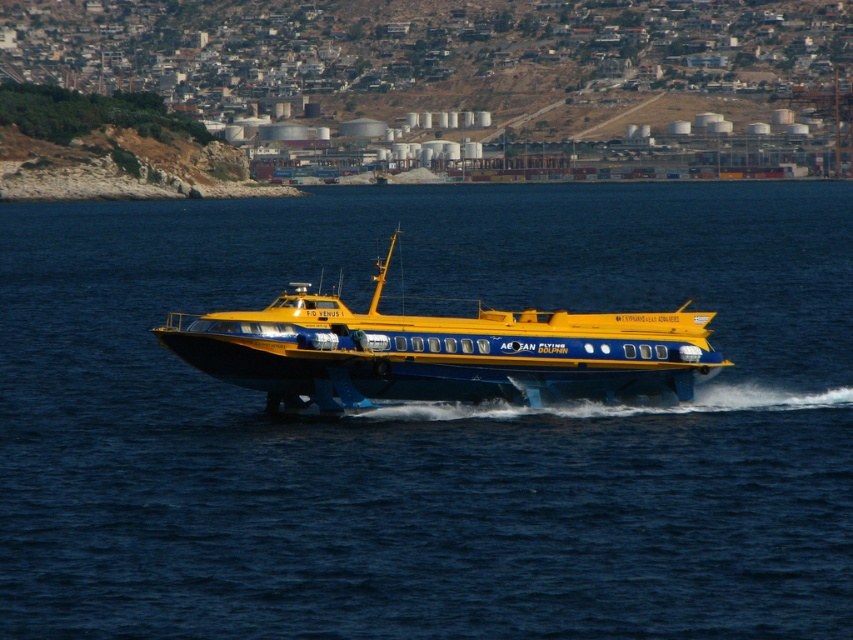
Is blue water at center positioned behind yellow matte hydrofoil at center?

That is False.

Which of these two, blue water at center or yellow matte hydrofoil at center, stands shorter?

Standing shorter between the two is yellow matte hydrofoil at center.

Between point (640, 300) and point (502, 312), which one is positioned in front?

Point (502, 312)

Where is `blue water at center`? The height and width of the screenshot is (640, 853). blue water at center is located at coordinates click(x=427, y=422).